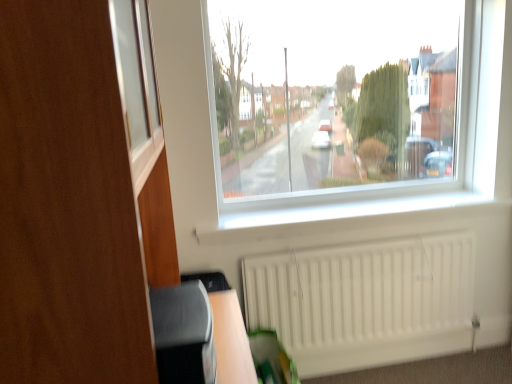
The height and width of the screenshot is (384, 512). What do you see at coordinates (361, 292) in the screenshot?
I see `white matte radiator at lower right` at bounding box center [361, 292].

Locate an element on the screen. Image resolution: width=512 pixels, height=384 pixels. white matte radiator at lower right is located at coordinates (361, 292).

What are the coordinates of `matte wood dresser at left` in the screenshot? It's located at (86, 202).

Describe the element at coordinates (86, 202) in the screenshot. I see `matte wood dresser at left` at that location.

Where is `white matte radiator at lower right`? This screenshot has width=512, height=384. white matte radiator at lower right is located at coordinates (361, 292).

Which object is positioned more to the left, white matte radiator at lower right or matte wood dresser at left?

matte wood dresser at left is more to the left.

Considering the positions of objects white matte radiator at lower right and matte wood dresser at left in the image provided, who is behind, white matte radiator at lower right or matte wood dresser at left?

Positioned behind is white matte radiator at lower right.

Does point (336, 275) appear closer or farther from the camera than point (11, 196)?

Point (336, 275) appears to be farther away from the viewer than point (11, 196).

From the image's perspective, is white matte radiator at lower right positioned above or below matte wood dresser at left?

From the image's perspective, white matte radiator at lower right appears below matte wood dresser at left.

From a real-world perspective, does white matte radiator at lower right sit lower than matte wood dresser at left?

Indeed, from a real-world perspective, white matte radiator at lower right is positioned beneath matte wood dresser at left.

Considering the relative sizes of white matte radiator at lower right and matte wood dresser at left in the image provided, is white matte radiator at lower right wider than matte wood dresser at left?

No, white matte radiator at lower right is not wider than matte wood dresser at left.

Does white matte radiator at lower right have a greater height compared to matte wood dresser at left?

In fact, white matte radiator at lower right may be shorter than matte wood dresser at left.

Based on the photo, is white matte radiator at lower right smaller than matte wood dresser at left?

Yes, white matte radiator at lower right is smaller than matte wood dresser at left.

Which is correct: white matte radiator at lower right is inside matte wood dresser at left, or outside of it?

white matte radiator at lower right exists outside the volume of matte wood dresser at left.

Are white matte radiator at lower right and matte wood dresser at left making contact?

white matte radiator at lower right is not next to matte wood dresser at left, and they're not touching.

Does white matte radiator at lower right turn towards matte wood dresser at left?

No, white matte radiator at lower right is not aimed at matte wood dresser at left.

Can you tell me how much white matte radiator at lower right and matte wood dresser at left differ in facing direction?

The angle between the facing direction of white matte radiator at lower right and the facing direction of matte wood dresser at left is 90.9 degrees.

In the scene shown: How much distance is there between white matte radiator at lower right and matte wood dresser at left?

white matte radiator at lower right and matte wood dresser at left are 1.35 meters apart.

This screenshot has height=384, width=512. Identify the location of radiator on the right of matte wood dresser at left. (361, 292).

Is matte wood dresser at left to the left of white matte radiator at lower right from the viewer's perspective?

Correct, you'll find matte wood dresser at left to the left of white matte radiator at lower right.

Which is behind, matte wood dresser at left or white matte radiator at lower right?

white matte radiator at lower right is behind.

Is point (37, 155) closer or farther from the camera than point (467, 237)?

Clearly, point (37, 155) is closer to the camera than point (467, 237).

Consider the image. From the image's perspective, would you say matte wood dresser at left is positioned over white matte radiator at lower right?

Correct, matte wood dresser at left appears higher than white matte radiator at lower right in the image.

From a real-world perspective, which is physically below, matte wood dresser at left or white matte radiator at lower right?

white matte radiator at lower right.

From the picture: Considering the sizes of objects matte wood dresser at left and white matte radiator at lower right in the image provided, who is thinner, matte wood dresser at left or white matte radiator at lower right?

white matte radiator at lower right is thinner.

Does matte wood dresser at left have a lesser height compared to white matte radiator at lower right?

In fact, matte wood dresser at left may be taller than white matte radiator at lower right.

Considering the sizes of objects matte wood dresser at left and white matte radiator at lower right in the image provided, who is smaller, matte wood dresser at left or white matte radiator at lower right?

white matte radiator at lower right.

Is white matte radiator at lower right located within matte wood dresser at left?

No, white matte radiator at lower right is located outside of matte wood dresser at left.

Is matte wood dresser at left positioned far away from white matte radiator at lower right?

Yes.

Is white matte radiator at lower right at the back of matte wood dresser at left?

No, matte wood dresser at left is not facing away from white matte radiator at lower right.

The image size is (512, 384). Find the location of `radiator below the matte wood dresser at left (from a real-world perspective)`. radiator below the matte wood dresser at left (from a real-world perspective) is located at coordinates coord(361,292).

Where is `dresser on the left side of white matte radiator at lower right`? dresser on the left side of white matte radiator at lower right is located at coordinates (86, 202).

The image size is (512, 384). Find the location of `dresser located above the white matte radiator at lower right (from the image's perspective)`. dresser located above the white matte radiator at lower right (from the image's perspective) is located at coordinates (86, 202).